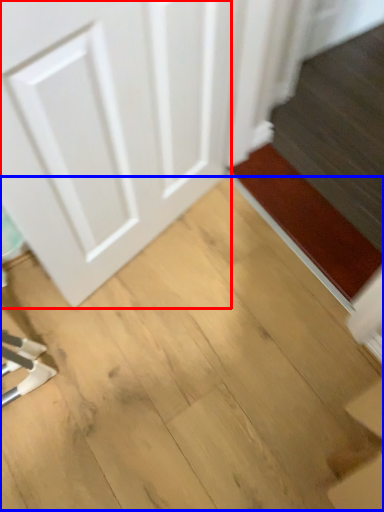
Question: Which of the following is the farthest to the observer, door (highlighted by a red box) or plywood (highlighted by a blue box)?

Choices:
 (A) door
 (B) plywood

Answer: (B)